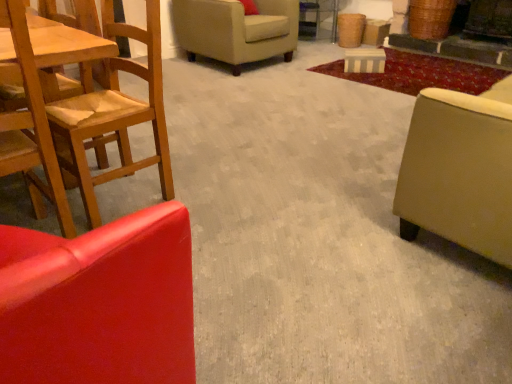
Question: Considering the relative sizes of wooden chair at left, the third chair positioned from the back, and beige fabric armchair at upper center, the third chair viewed from the front, in the image provided, is wooden chair at left, the third chair positioned from the back, bigger than beige fabric armchair at upper center, the third chair viewed from the front,?

Choices:
 (A) no
 (B) yes

Answer: (A)

Question: Does wooden chair at left, marked as the 1th chair in a front-to-back arrangement, have a lesser height compared to beige fabric armchair at upper center, the third chair viewed from the front?

Choices:
 (A) no
 (B) yes

Answer: (A)

Question: Is wooden chair at left, marked as the 1th chair in a front-to-back arrangement, further to camera compared to beige fabric armchair at upper center, the third chair viewed from the front?

Choices:
 (A) no
 (B) yes

Answer: (A)

Question: Is wooden chair at left, the third chair positioned from the back, taller than beige fabric armchair at upper center, the third chair viewed from the front?

Choices:
 (A) no
 (B) yes

Answer: (B)

Question: Is wooden chair at left, the third chair positioned from the back, facing towards beige fabric armchair at upper center, the third chair viewed from the front?

Choices:
 (A) yes
 (B) no

Answer: (B)

Question: Is beige fabric armchair at upper center, which appears as the 1th chair when viewed from the back, spatially inside wooden chair at left, marked as the 1th chair in a front-to-back arrangement, or outside of it?

Choices:
 (A) outside
 (B) inside

Answer: (A)

Question: Visually, is beige fabric armchair at upper center, the third chair viewed from the front, positioned to the left or to the right of wooden chair at left, marked as the 1th chair in a front-to-back arrangement?

Choices:
 (A) right
 (B) left

Answer: (A)

Question: Looking at the image, does beige fabric armchair at upper center, which appears as the 1th chair when viewed from the back, seem bigger or smaller compared to wooden chair at left, the third chair positioned from the back?

Choices:
 (A) small
 (B) big

Answer: (B)

Question: Looking at their shapes, would you say beige fabric armchair at upper center, which appears as the 1th chair when viewed from the back, is wider or thinner than wooden chair at left, marked as the 1th chair in a front-to-back arrangement?

Choices:
 (A) wide
 (B) thin

Answer: (A)

Question: Considering the positions of wooden chair at left, marked as the 1th chair in a front-to-back arrangement, and beige fabric studio couch at right in the image, is wooden chair at left, marked as the 1th chair in a front-to-back arrangement, bigger or smaller than beige fabric studio couch at right?

Choices:
 (A) big
 (B) small

Answer: (B)

Question: From a real-world perspective, is wooden chair at left, marked as the 1th chair in a front-to-back arrangement, above or below beige fabric studio couch at right?

Choices:
 (A) above
 (B) below

Answer: (A)

Question: Relative to beige fabric studio couch at right, is wooden chair at left, marked as the 1th chair in a front-to-back arrangement, in front or behind?

Choices:
 (A) behind
 (B) front

Answer: (B)

Question: In terms of width, does wooden chair at left, the third chair positioned from the back, look wider or thinner when compared to beige fabric studio couch at right?

Choices:
 (A) thin
 (B) wide

Answer: (A)

Question: Based on their positions, is beige fabric studio couch at right located to the left or right of wooden chair at left, the third chair positioned from the back?

Choices:
 (A) left
 (B) right

Answer: (B)

Question: Does point (508, 248) appear closer or farther from the camera than point (45, 125)?

Choices:
 (A) closer
 (B) farther

Answer: (B)